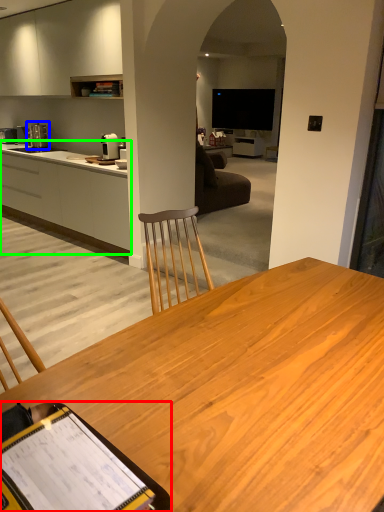
Question: Based on their relative distances, which object is farther from clipboard (highlighted by a red box)? Choose from coffee machine (highlighted by a blue box) and cabinetry (highlighted by a green box).

Choices:
 (A) coffee machine
 (B) cabinetry

Answer: (A)